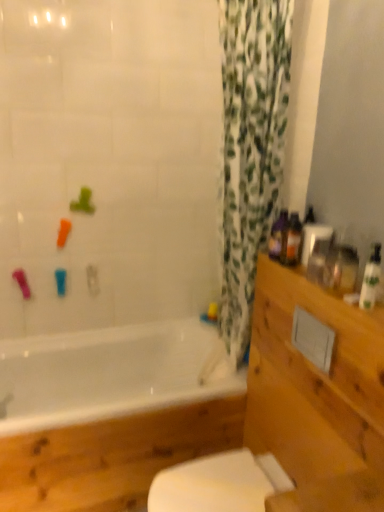
Identify the location of vacant area on top of white glossy toilet at lower center (from a real-world perspective). The height and width of the screenshot is (512, 384). (217, 482).